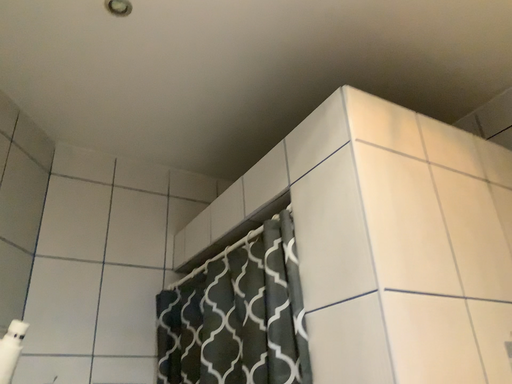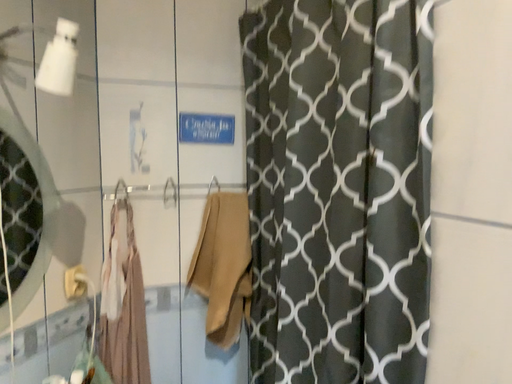
Question: Which way did the camera rotate in the video?

Choices:
 (A) rotated downward
 (B) rotated upward

Answer: (A)